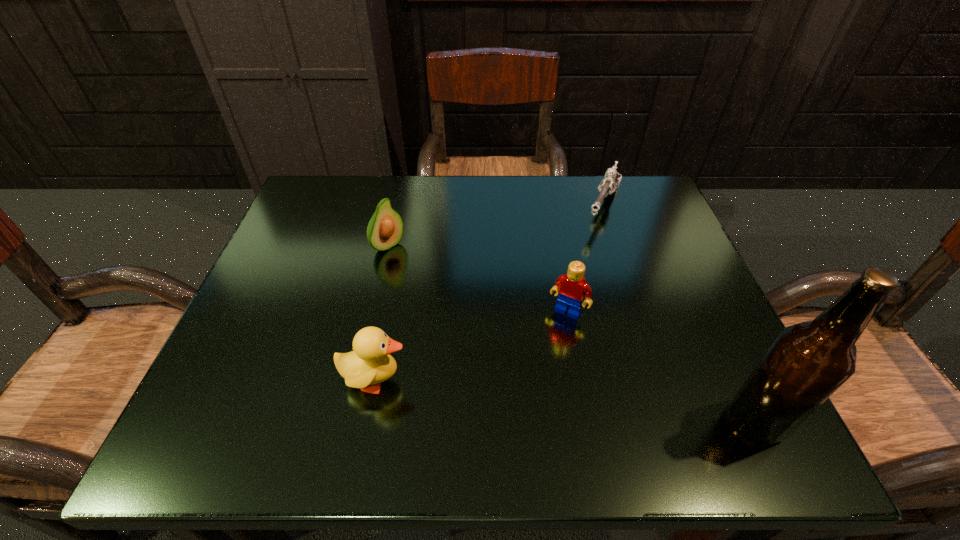
Locate an element on the screen. The width and height of the screenshot is (960, 540). beer bottle at the near edge is located at coordinates (809, 361).

Where is `beer bottle positioned at the right edge`? beer bottle positioned at the right edge is located at coordinates (809, 361).

Locate an element on the screen. The height and width of the screenshot is (540, 960). gun situated at the right edge is located at coordinates click(x=612, y=178).

Locate an element on the screen. Image resolution: width=960 pixels, height=540 pixels. object that is at the far right corner is located at coordinates (612, 178).

Where is `object that is at the near right corner`? The height and width of the screenshot is (540, 960). object that is at the near right corner is located at coordinates (809, 361).

Locate an element on the screen. vacant region at the far edge of the desktop is located at coordinates (555, 225).

This screenshot has height=540, width=960. In the image, there is a desktop. Find the location of `blank space at the near edge`. blank space at the near edge is located at coordinates (612, 362).

What are the coordinates of `free spot at the left edge of the desktop` in the screenshot? It's located at (297, 247).

Image resolution: width=960 pixels, height=540 pixels. Find the location of `vacant space at the right edge of the desktop`. vacant space at the right edge of the desktop is located at coordinates (676, 334).

Locate an element on the screen. The height and width of the screenshot is (540, 960). vacant point at the far left corner is located at coordinates (358, 224).